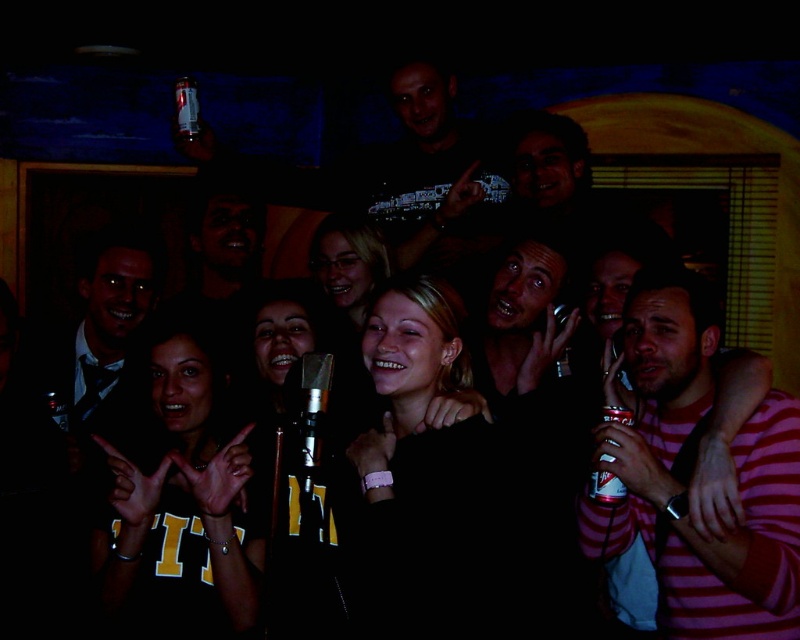
You are a photographer at the event and want to capture a clear photo of the smooth blonde hair at center without the dark matte shirt at center blocking it. Is this possible?

The dark matte shirt at center is positioned over smooth blonde hair at center, so it is blocking the view. To capture the smooth blonde hair at center clearly, you would need to adjust the angle or have the person move so that the dark matte shirt at center is no longer covering it.